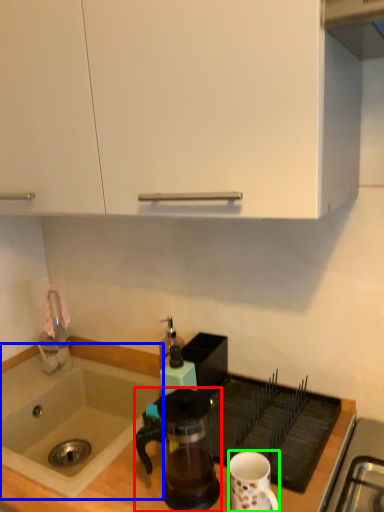
Question: Which object is the closest to the coffee maker (highlighted by a red box)? Choose among these: sink (highlighted by a blue box) or coffee cup (highlighted by a green box).

Choices:
 (A) sink
 (B) coffee cup

Answer: (B)